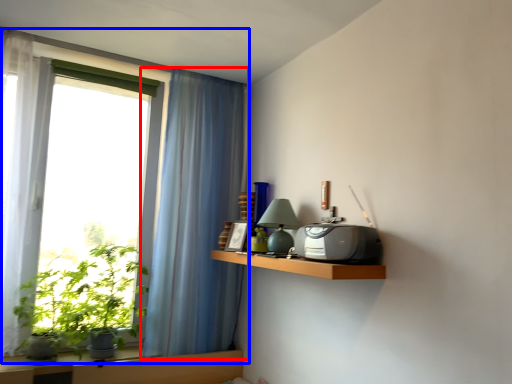
Question: Which of the following is the farthest to the observer, curtain (highlighted by a red box) or window (highlighted by a blue box)?

Choices:
 (A) curtain
 (B) window

Answer: (A)